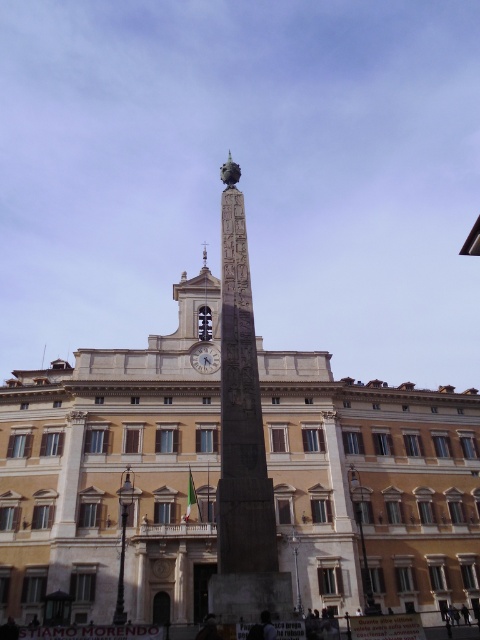
You are standing in front of the grand historical building and want to take a photo of the granite obelisk at center. If you look at the building from the front, where should you aim your camera to capture the obelisk perfectly in the frame?

The granite obelisk at center is located at the 2D coordinates point (242,444), so you should aim your camera slightly to the right and center to capture it perfectly in the frame.

You are a tour guide explaining the historical site to visitors. You point out the granite obelisk at center and the matte silver clock at center. Which one do you tell them is larger?

The granite obelisk at center is bigger than the matte silver clock at center.

You are a tourist standing in front of the grand historical building. You notice the granite obelisk at center and the matte silver clock at center. Which object is positioned higher up in the image?

The matte silver clock at center is positioned higher up because the granite obelisk at center is located below it.